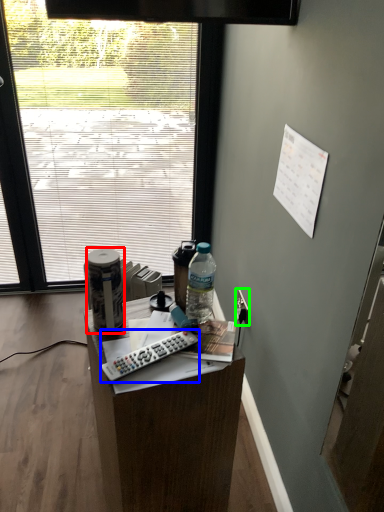
Question: Which is nearer to the bottle (highlighted by a red box)? remote control (highlighted by a blue box) or power outlet (highlighted by a green box).

Choices:
 (A) remote control
 (B) power outlet

Answer: (A)